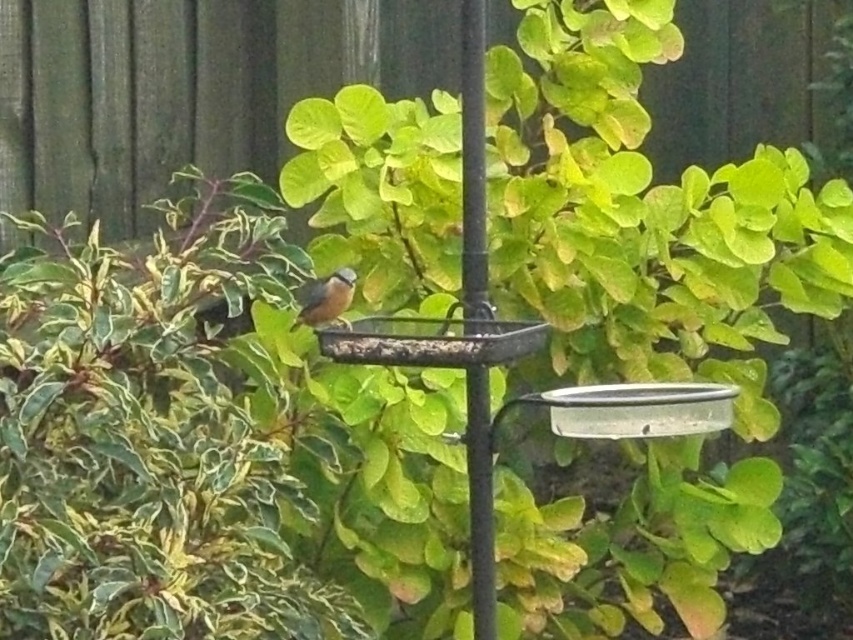
Question: Which point is closer to the camera taking this photo?

Choices:
 (A) click(x=648, y=246)
 (B) click(x=460, y=365)
 (C) click(x=329, y=289)
 (D) click(x=467, y=120)

Answer: (B)

Question: Can you confirm if black metal pole at center is positioned below metallic silver bird feeder at center?

Choices:
 (A) yes
 (B) no

Answer: (A)

Question: Is green leafy bush at center below brown matte bird at center?

Choices:
 (A) no
 (B) yes

Answer: (B)

Question: Which object is positioned farthest from the black metal pole at center?

Choices:
 (A) brown matte bird at center
 (B) metallic silver bird feeder at center

Answer: (A)

Question: Which object is farther from the camera taking this photo?

Choices:
 (A) brown matte bird at center
 (B) metallic silver bird feeder at center
 (C) black metal pole at center

Answer: (A)

Question: In this image, where is black metal pole at center located relative to brown matte bird at center?

Choices:
 (A) below
 (B) above

Answer: (A)